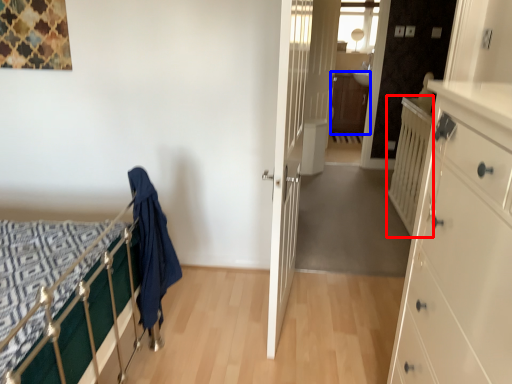
Question: Which object is further to the camera taking this photo, balustrade (highlighted by a red box) or file cabinet (highlighted by a blue box)?

Choices:
 (A) balustrade
 (B) file cabinet

Answer: (B)